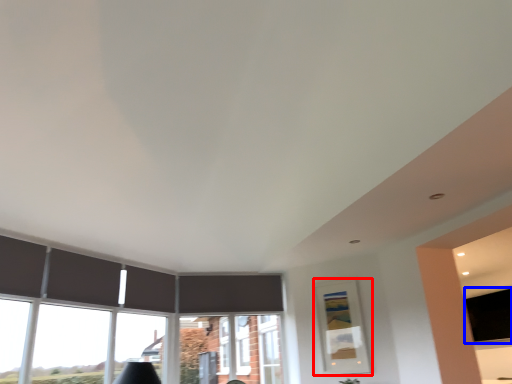
Question: Which object appears farthest to the camera in this image, picture frame (highlighted by a red box) or window screen (highlighted by a blue box)?

Choices:
 (A) picture frame
 (B) window screen

Answer: (B)